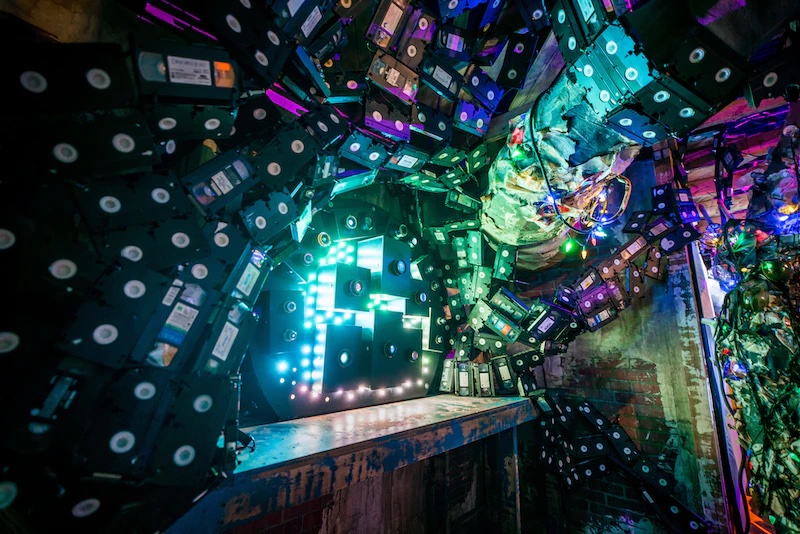
Locate an element on the screen. The height and width of the screenshot is (534, 800). front of  counter is located at coordinates (390, 450).